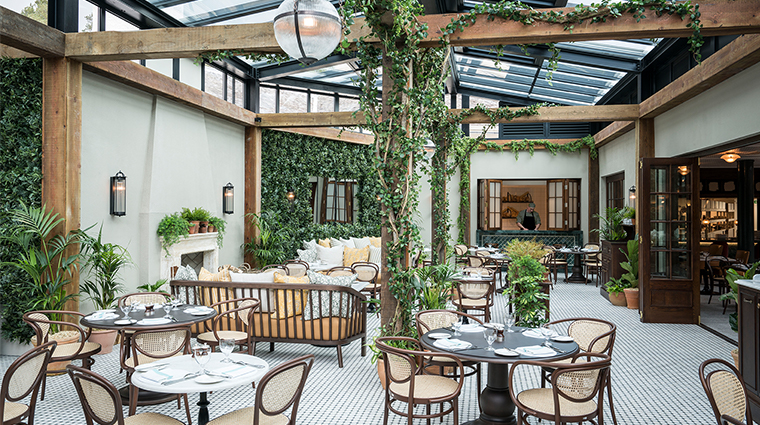
Find the location of a particular element. The image size is (760, 425). chair is located at coordinates (273, 402).